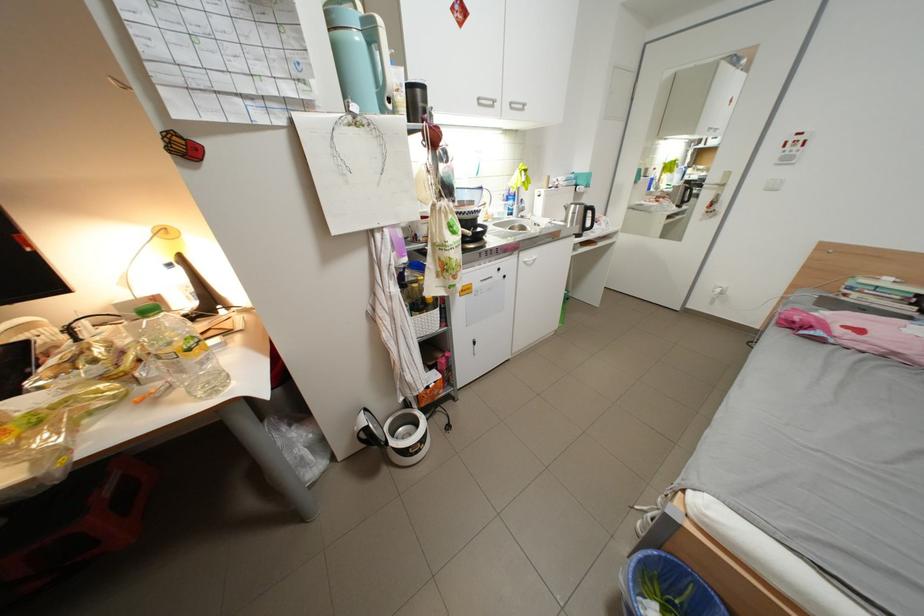
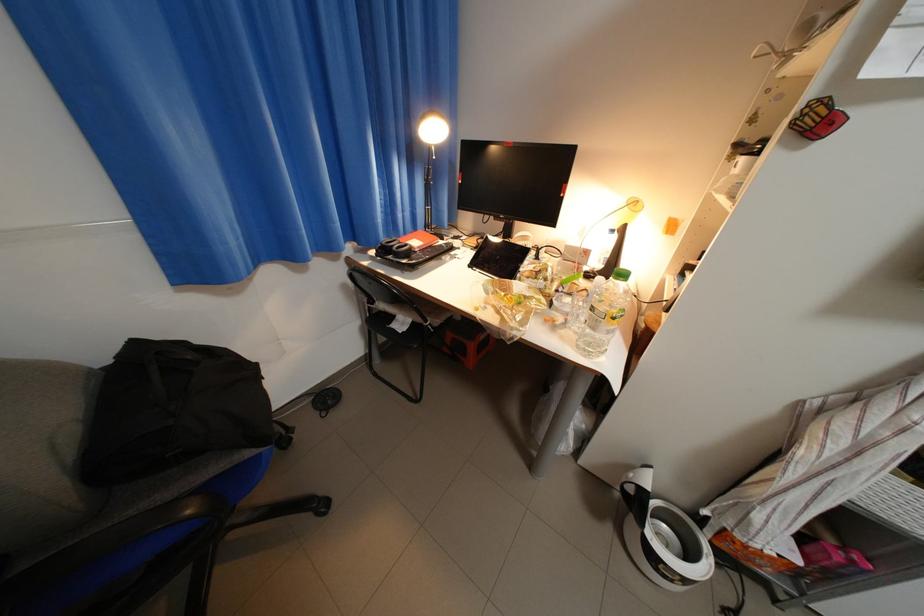
The first image is from the beginning of the video and the second image is from the end. How did the camera likely rotate when shooting the video?

The camera's rotation is toward left-down.